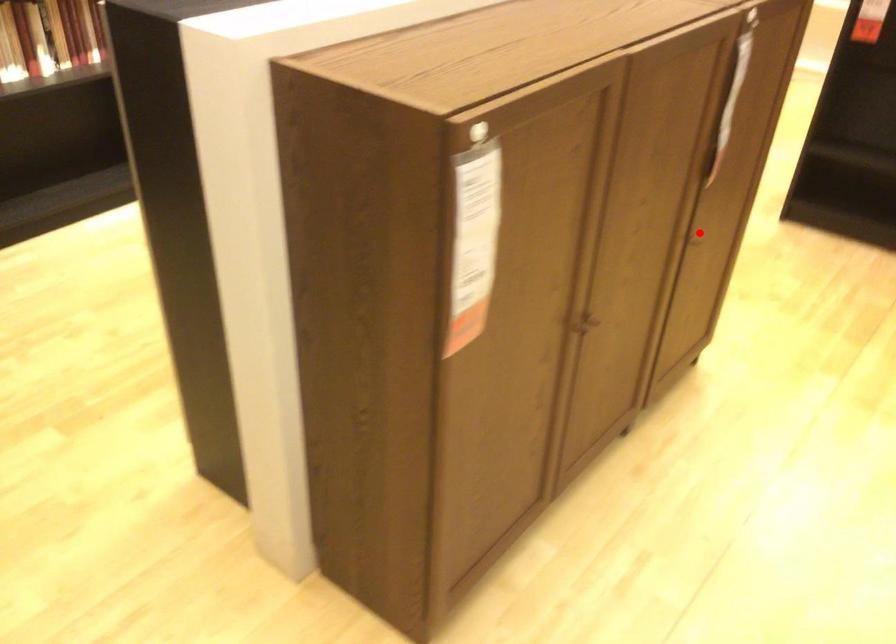
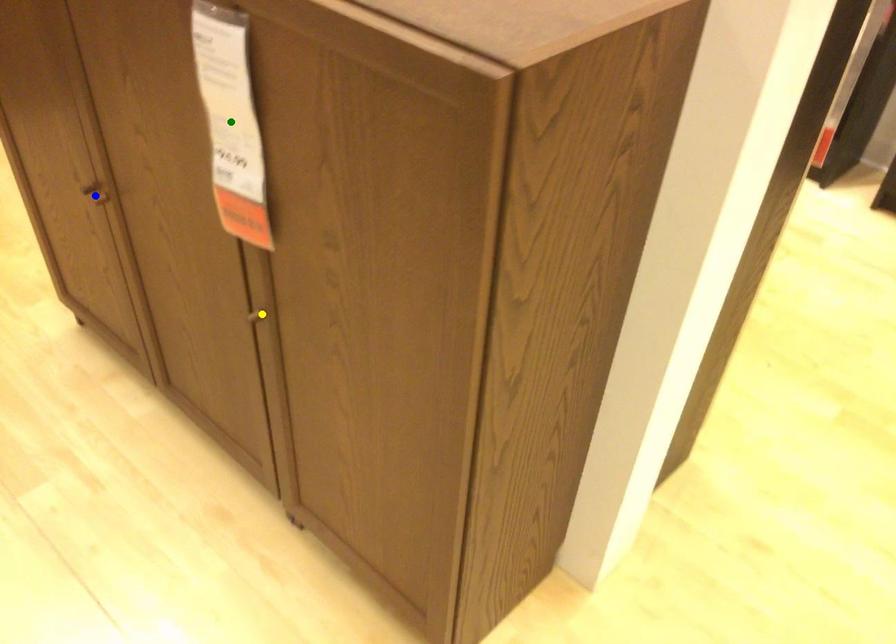
Question: I am providing you with two images of the same scene from different viewpoints. A red point is marked on the first image. You are given multiple points on the second image. Which spot in image 2 lines up with the point in image 1?

Choices:
 (A) blue point
 (B) yellow point
 (C) green point

Answer: (B)